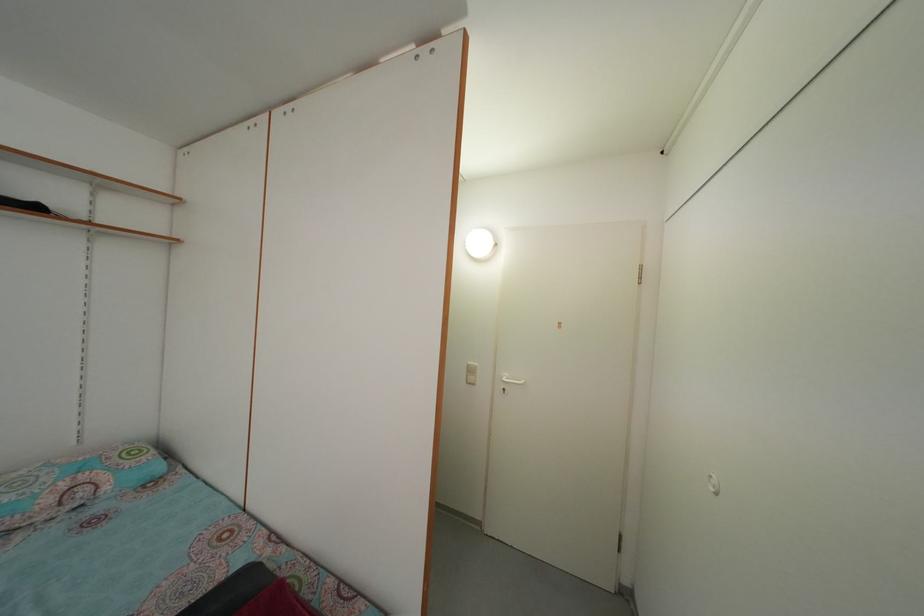
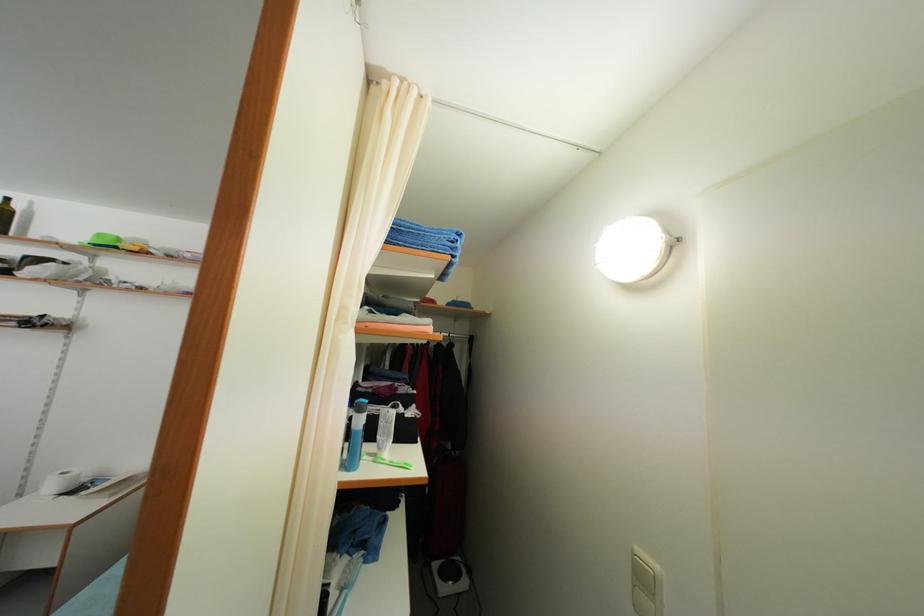
Question: Based on the continuous images, in which direction is the camera rotating? Reply with the corresponding letter.

Choices:
 (A) Left
 (B) Right
 (C) Up
 (D) Down

Answer: (A)